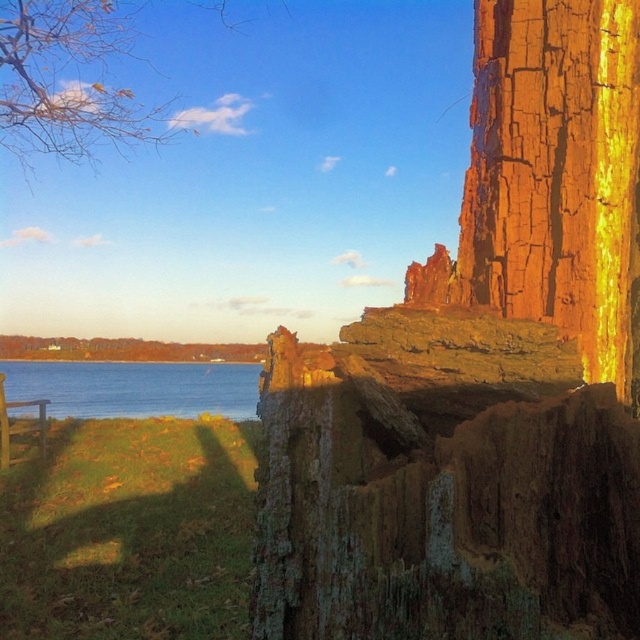
You are an artist sketching this lakeside scene. You want to ensure the yellow leafy branches at upper left and blue water at lower left are proportionally accurate. Which object should you draw wider in your sketch?

The blue water at lower left should be drawn wider since it has a greater width compared to the yellow leafy branches at upper left.

You are standing at the center of the wooden structure in the foreground. Looking towards the upper left corner of your view, where exactly would you find the yellow leafy branches at upper left?

The yellow leafy branches at upper left are located at the 2D coordinates point (72, 81).

You are standing at the point labeled point (481, 380) in the image. What object is directly beneath your feet?

The point labeled point (481, 380) corresponds to the rusty metallic cliff at center, so the object directly beneath your feet is the rusty metallic cliff at center.